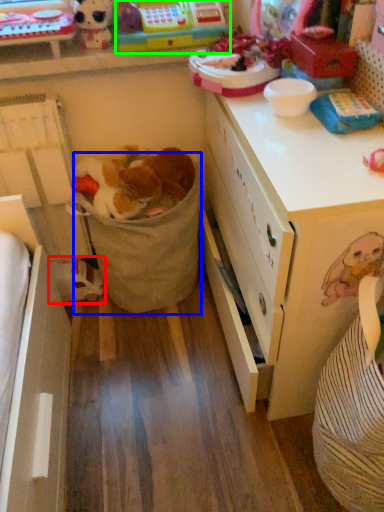
Question: Considering the real-world distances, which object is farthest from toy (highlighted by a red box)? laundry basket (highlighted by a blue box) or toy (highlighted by a green box)?

Choices:
 (A) laundry basket
 (B) toy

Answer: (B)